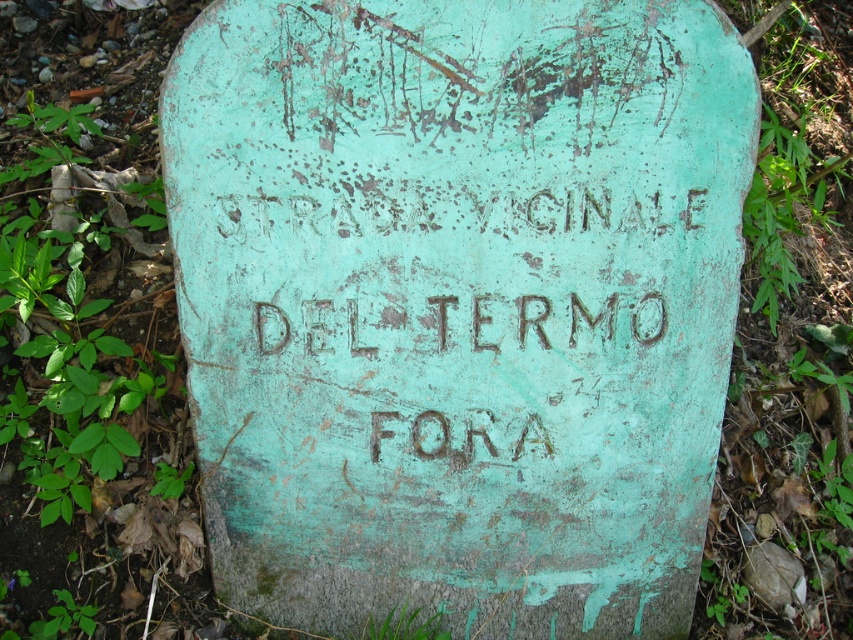
Question: Can you confirm if green patina stone sign at center is positioned above green patina stone at lower right?

Choices:
 (A) yes
 (B) no

Answer: (A)

Question: Considering the relative positions of green patina stone sign at center and green patina stone at lower right in the image provided, where is green patina stone sign at center located with respect to green patina stone at lower right?

Choices:
 (A) below
 (B) above

Answer: (B)

Question: Is green patina stone sign at center above green patina stone at lower right?

Choices:
 (A) yes
 (B) no

Answer: (A)

Question: Which point is closer to the camera?

Choices:
 (A) green patina stone sign at center
 (B) green patina stone at lower right

Answer: (A)